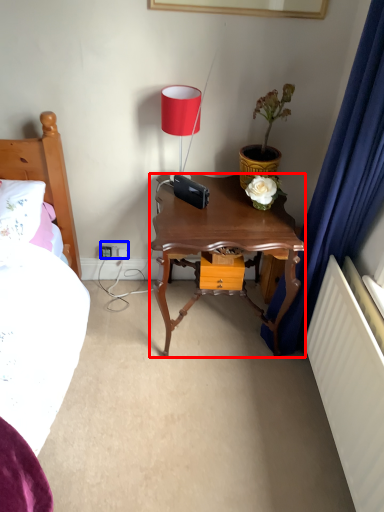
Question: Which object is further to the camera taking this photo, nightstand (highlighted by a red box) or electric outlet (highlighted by a blue box)?

Choices:
 (A) nightstand
 (B) electric outlet

Answer: (B)